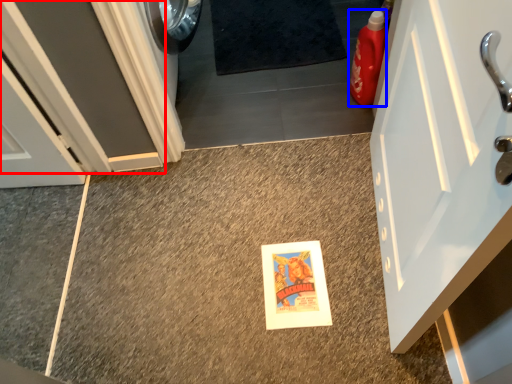
Question: Among these objects, which one is farthest to the camera, door (highlighted by a red box) or cleaning product (highlighted by a blue box)?

Choices:
 (A) door
 (B) cleaning product

Answer: (B)